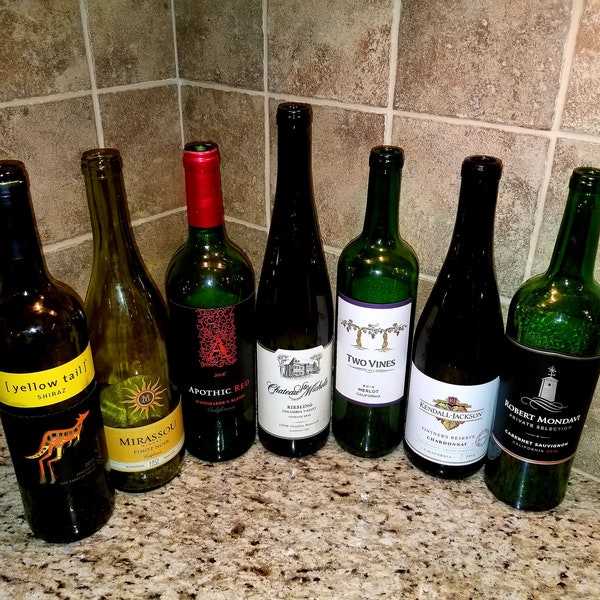
The image size is (600, 600). Find the location of `bottle`. bottle is located at coordinates (112, 217).